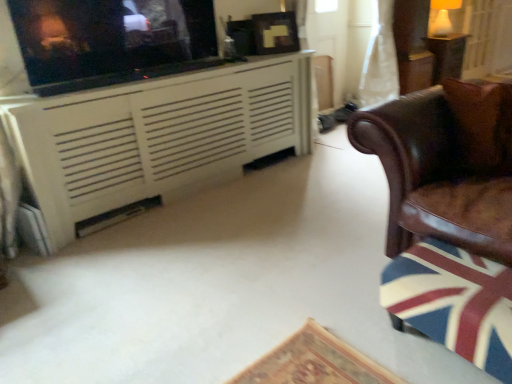
This screenshot has width=512, height=384. Identify the location of vacant area that lies between wooden swivel chair at right and white painted wood cabinet at upper left. (251, 236).